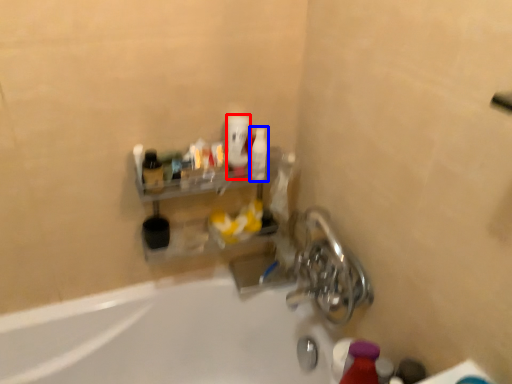
Question: Which object appears closest to the camera in this image, mouthwash (highlighted by a red box) or mouthwash (highlighted by a blue box)?

Choices:
 (A) mouthwash
 (B) mouthwash

Answer: (A)